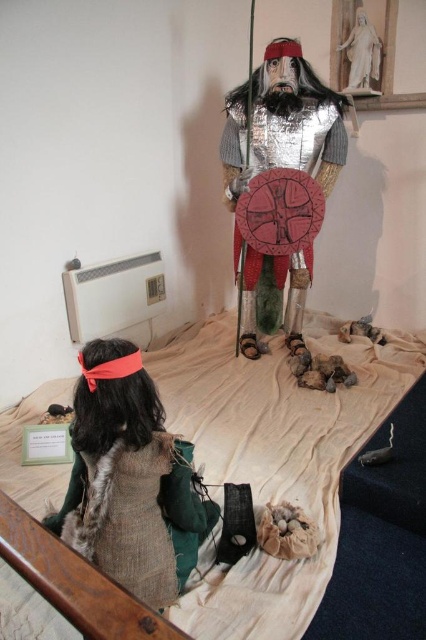
Question: Does white fabric bed at center appear over shiny silver armor at center?

Choices:
 (A) no
 (B) yes

Answer: (A)

Question: Does white fabric bed at center have a larger size compared to shiny silver armor at center?

Choices:
 (A) no
 (B) yes

Answer: (B)

Question: Is white fabric bed at center bigger than shiny silver armor at center?

Choices:
 (A) no
 (B) yes

Answer: (B)

Question: Among these points, which one is farthest from the camera?

Choices:
 (A) (255, 330)
 (B) (298, 400)

Answer: (A)

Question: Which point appears farthest from the camera in this image?

Choices:
 (A) (190, 396)
 (B) (259, 81)

Answer: (A)